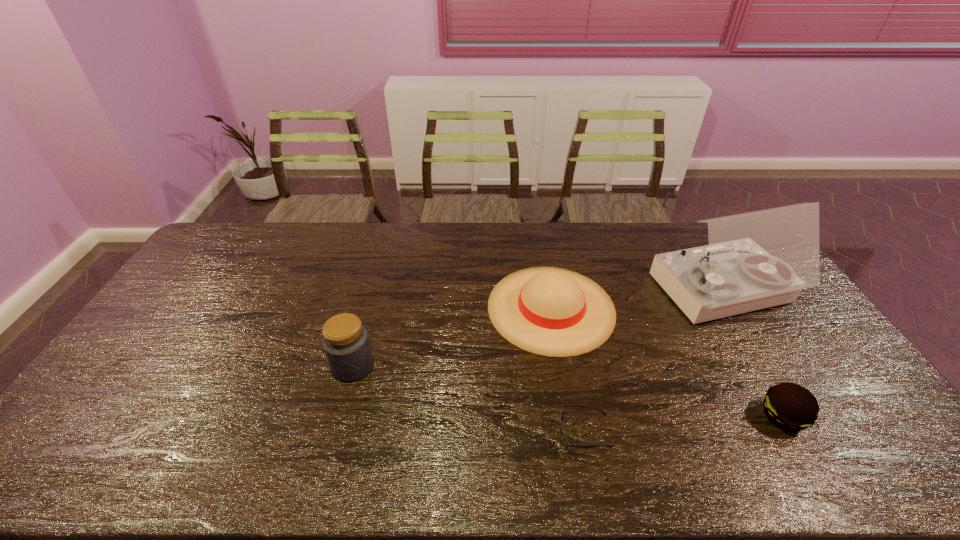
You are a GUI agent. You are given a task and a screenshot of the screen. Output one action in this format:
    pyautogui.click(x=<x>, y=<y>)
    Task: Click on the tallest object
    The height and width of the screenshot is (540, 960).
    Given the screenshot: What is the action you would take?
    pos(760,259)

Find the location of a particular element. This screenshot has width=960, height=540. jar is located at coordinates (346, 344).

What are the coordinates of `the leftmost object` in the screenshot? It's located at (346, 344).

Locate an element on the screen. the third tallest object is located at coordinates tap(555, 312).

Image resolution: width=960 pixels, height=540 pixels. I want to click on the second shortest object, so click(x=789, y=406).

This screenshot has width=960, height=540. Identify the location of the shortest object. (565, 442).

I want to click on blank area located on the front of the tallest object, so click(x=783, y=394).

You are a GUI agent. You are given a task and a screenshot of the screen. Output one action in this format:
    pyautogui.click(x=<x>, y=<y>)
    Task: Click on the vacant area located 0.070m on the surface of the fourth shortest object near the warning symbol
    Image resolution: width=960 pixels, height=540 pixels.
    Given the screenshot: What is the action you would take?
    pyautogui.click(x=343, y=406)

Locate an element on the screen. free space located 0.270m on the back of the sombrero is located at coordinates (537, 225).

Where is `free space located 0.130m on the back of the patty`? The width and height of the screenshot is (960, 540). free space located 0.130m on the back of the patty is located at coordinates (749, 358).